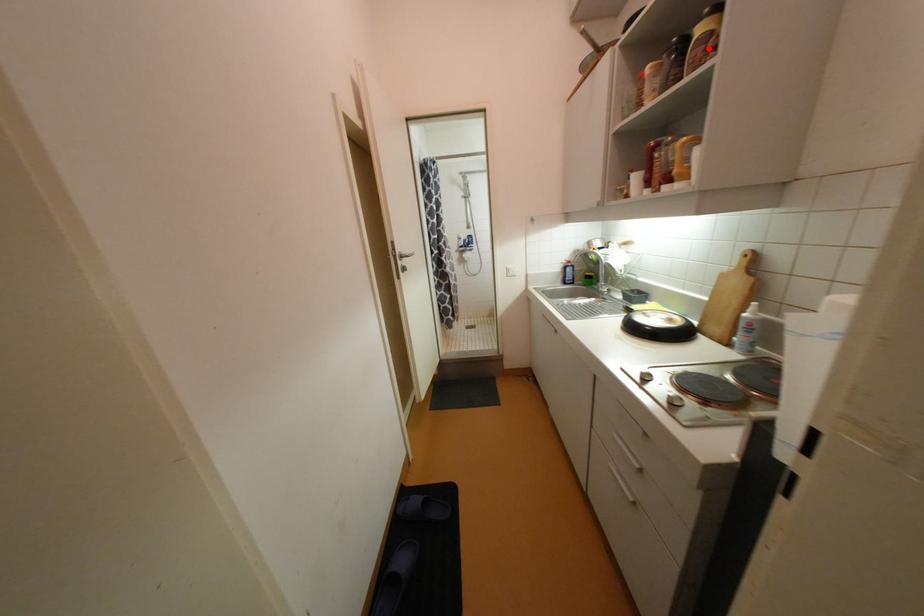
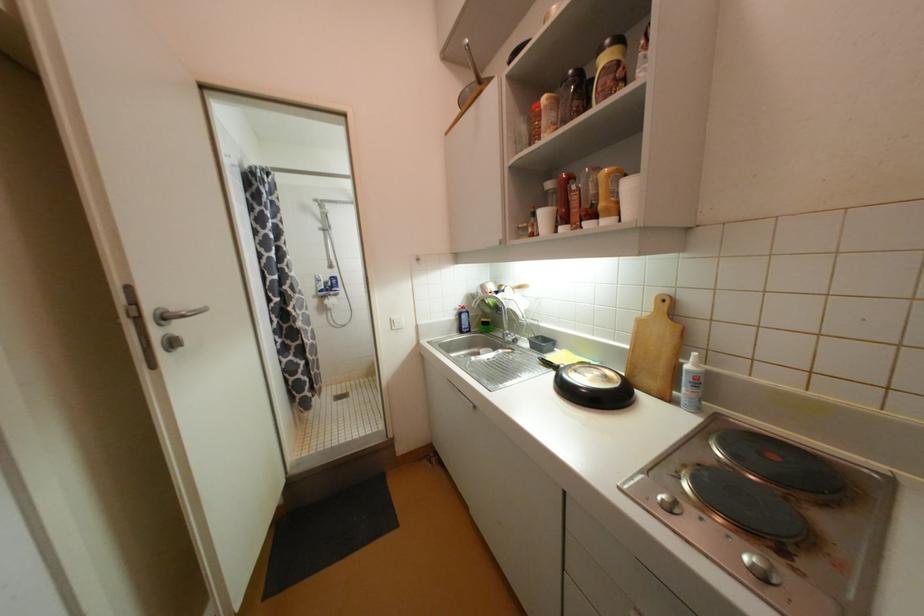
Where in the second image is the point corresponding to the highlighted location from the first image?

(616, 78)